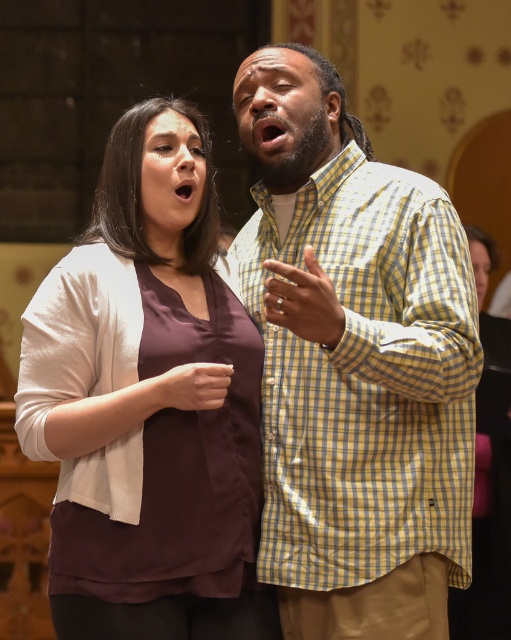
You are a photographer setting up for a photoshoot. You need to position a spotlight so it illuminates both the yellow checkered shirt at center and the matte brown blouse at center. Based on their positions, which one should you aim the spotlight at first to ensure both are lit properly?

The yellow checkered shirt at center is below the matte brown blouse at center, so you should aim the spotlight at the matte brown blouse at center first to ensure it reaches both the upper and lower positions.

You are a stagehand setting up a microphone stand between the yellow checkered shirt at center and the matte brown blouse at center. If the microphone stand requires 1.5 meters of space to fit, will it fit between them?

The yellow checkered shirt at center is 2.02 meters from the matte brown blouse at center, so yes, the microphone stand will fit between them since the distance is greater than the required 1.5 meters.